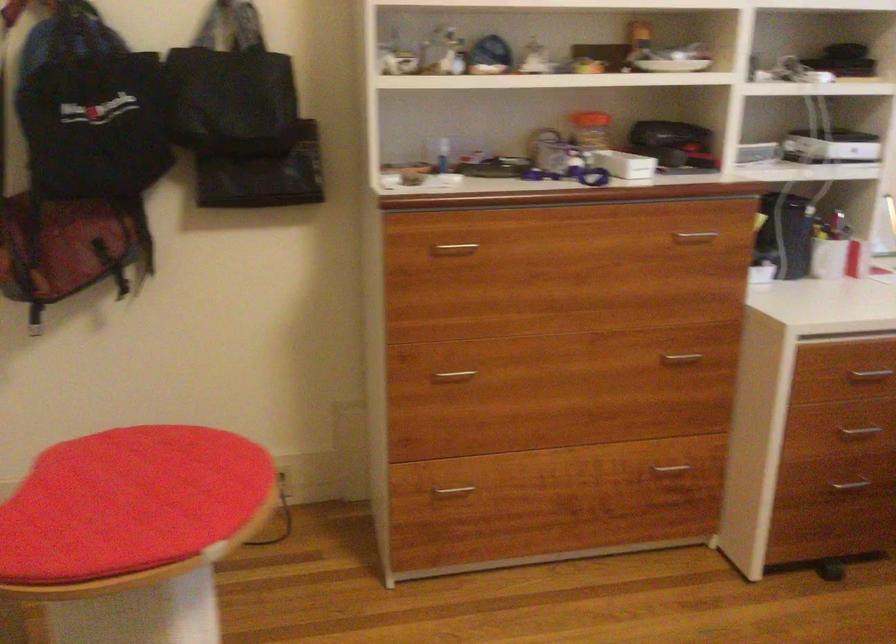
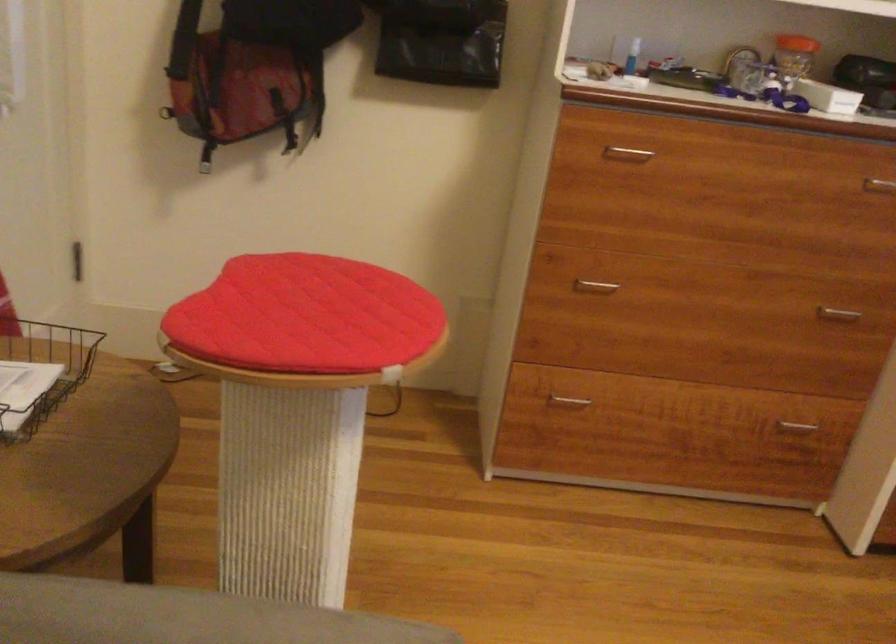
Locate, in the second image, the point that corresponds to point 683,359 in the first image.

(837, 313)